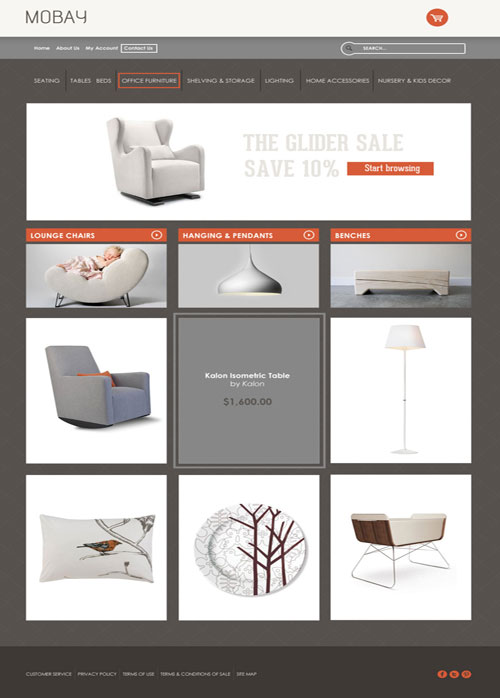
Locate an element on the screen. This screenshot has height=698, width=500. grey chair with an orange pillow is located at coordinates (84, 385).